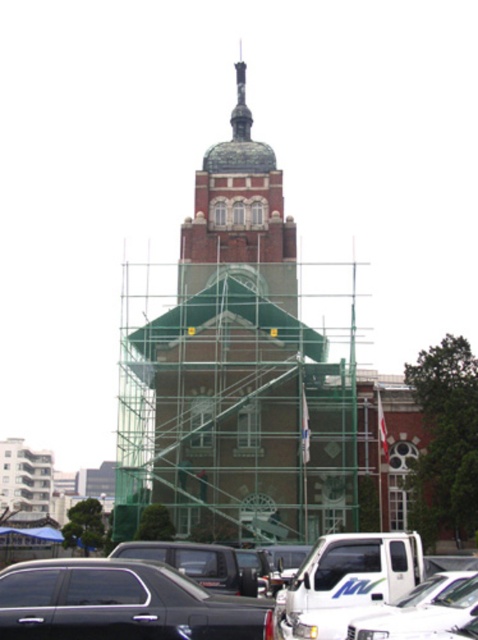
Does brown brick tower at center have a greater width compared to shiny black sedan at center?

Yes.

Who is more forward, (141, 346) or (28, 605)?

Point (28, 605)

Which is in front, point (141, 396) or point (7, 598)?

Point (7, 598) is more forward.

Where is `brown brick tower at center`? brown brick tower at center is located at coordinates (242, 369).

Looking at this image, between brown brick tower at center and white matte truck at center, which one has more height?

Standing taller between the two is brown brick tower at center.

What do you see at coordinates (242, 369) in the screenshot?
I see `brown brick tower at center` at bounding box center [242, 369].

Is point (177, 381) farther from camera compared to point (471, 609)?

Yes.

Where is `brown brick tower at center`? brown brick tower at center is located at coordinates (242, 369).

Does shiny black sedan at lower left lie in front of white matte truck at center?

Yes, it is in front of white matte truck at center.

Can you confirm if shiny black sedan at lower left is positioned to the left of white matte truck at center?

Indeed, shiny black sedan at lower left is positioned on the left side of white matte truck at center.

Is point (160, 605) in front of point (425, 620)?

Yes.

Locate an element on the screen. Image resolution: width=478 pixels, height=640 pixels. shiny black sedan at lower left is located at coordinates (120, 604).